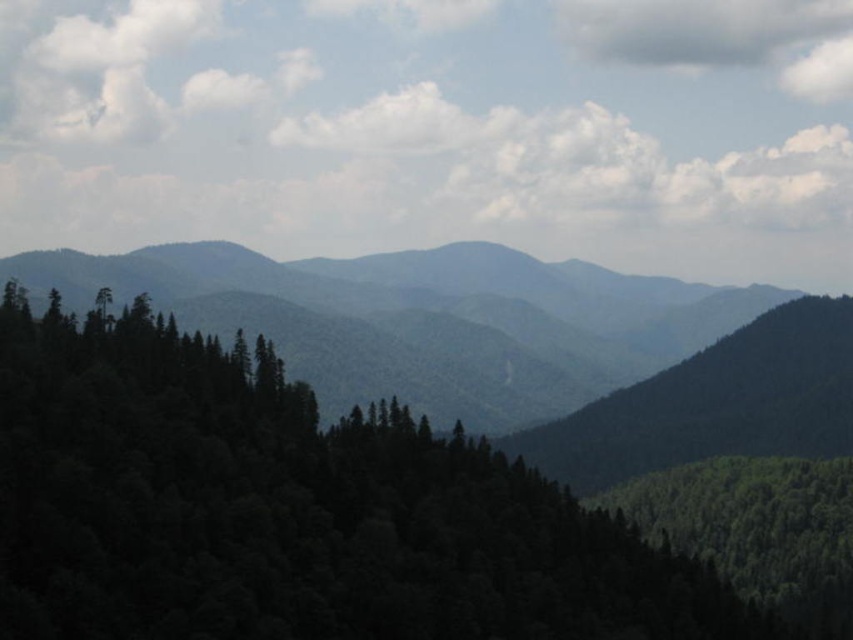
Who is more distant from viewer, (590, 266) or (648, 35)?

Positioned behind is point (648, 35).

Between green textured forest at center and gray fluffy cloud at upper right, which one has more height?

Standing taller between the two is green textured forest at center.

What do you see at coordinates (422, 320) in the screenshot? The width and height of the screenshot is (853, 640). I see `green textured forest at center` at bounding box center [422, 320].

Find the location of `green textured forest at center`. green textured forest at center is located at coordinates (422, 320).

Is point (252, 100) in front of point (447, 403)?

No.

Find the location of a particular element. The width and height of the screenshot is (853, 640). white fluffy cloud at upper center is located at coordinates (434, 129).

Where is `white fluffy cloud at upper center`? This screenshot has width=853, height=640. white fluffy cloud at upper center is located at coordinates (434, 129).

Measure the distance between white fluffy cloud at upper center and gray fluffy cloud at upper right.

A distance of 57.55 meters exists between white fluffy cloud at upper center and gray fluffy cloud at upper right.

Consider the image. Does white fluffy cloud at upper center have a greater height compared to gray fluffy cloud at upper right?

Yes, white fluffy cloud at upper center is taller than gray fluffy cloud at upper right.

Is point (610, 148) positioned in front of point (810, 38)?

Yes, point (610, 148) is closer to viewer.

Locate an element on the screen. The width and height of the screenshot is (853, 640). white fluffy cloud at upper center is located at coordinates (434, 129).